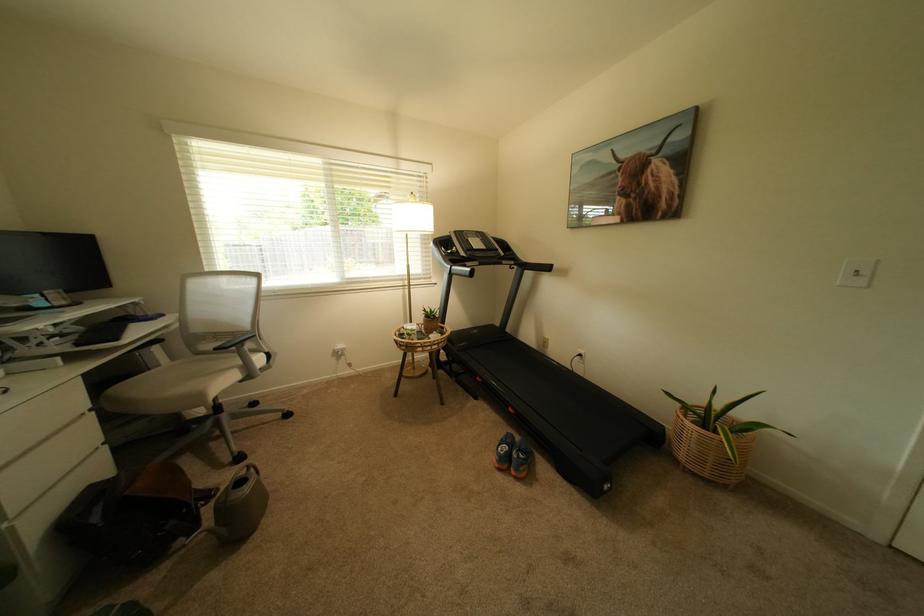
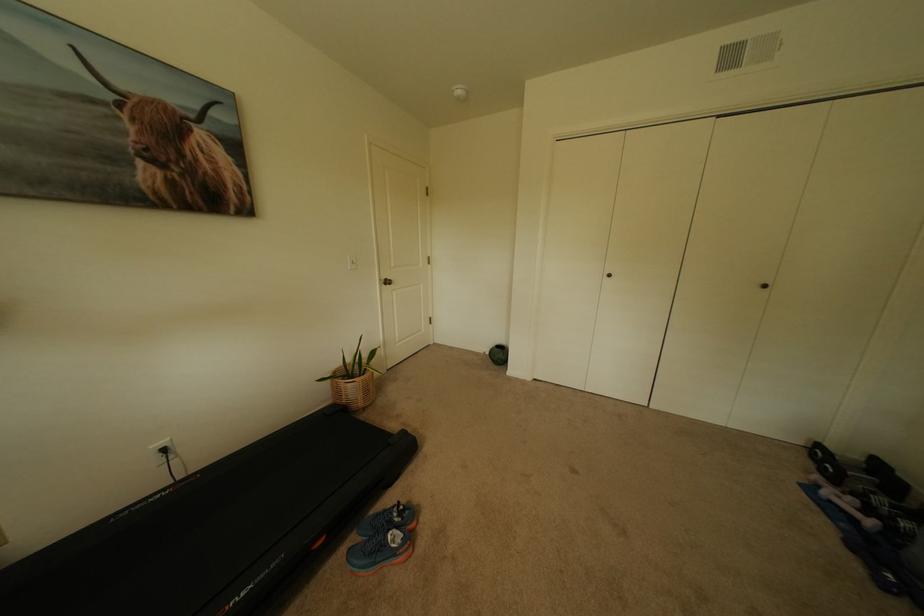
In the second image, find the point that corresponds to the point at 695,448 in the first image.

(370, 395)